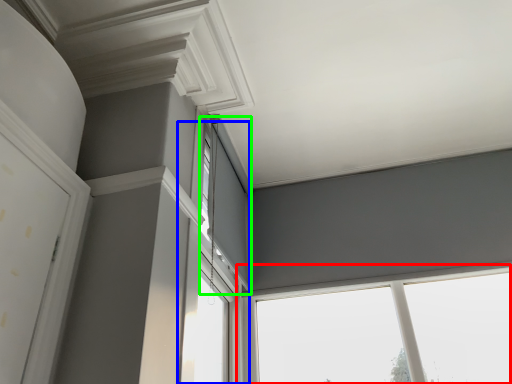
Question: Considering the real-world distances, which object is closest to window (highlighted by a red box)? window (highlighted by a blue box) or window (highlighted by a green box).

Choices:
 (A) window
 (B) window

Answer: (A)